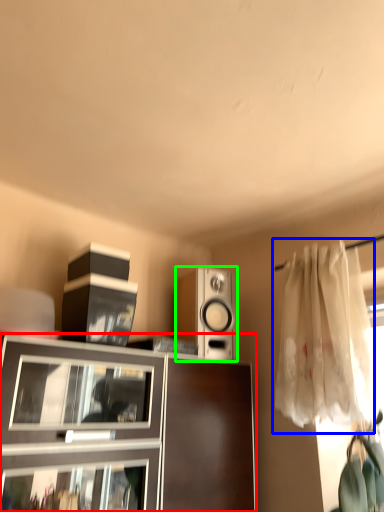
Question: Considering the real-world distances, which object is closest to cabinetry (highlighted by a red box)? curtain (highlighted by a blue box) or loudspeaker (highlighted by a green box).

Choices:
 (A) curtain
 (B) loudspeaker

Answer: (B)